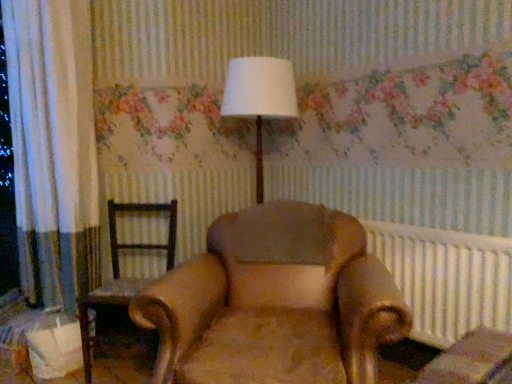
Question: From the image's perspective, relative to white plastic radiator at right, is brown leather chair at left, placed as the second chair when sorted from right to left, above or below?

Choices:
 (A) above
 (B) below

Answer: (B)

Question: Considering their positions, is brown leather chair at left, placed as the second chair when sorted from right to left, located in front of or behind white plastic radiator at right?

Choices:
 (A) behind
 (B) front

Answer: (A)

Question: Which object is the farthest from the brown leather chair at left, placed as the second chair when sorted from right to left?

Choices:
 (A) white fabric lampshade at center
 (B) white plastic radiator at right
 (C) leather armchair at center, the second chair viewed from the left

Answer: (B)

Question: Which of these objects is positioned closest to the white fabric lampshade at center?

Choices:
 (A) brown leather chair at left, positioned as the 1th chair in left-to-right order
 (B) white plastic radiator at right
 (C) leather armchair at center, the first chair when ordered from right to left

Answer: (C)